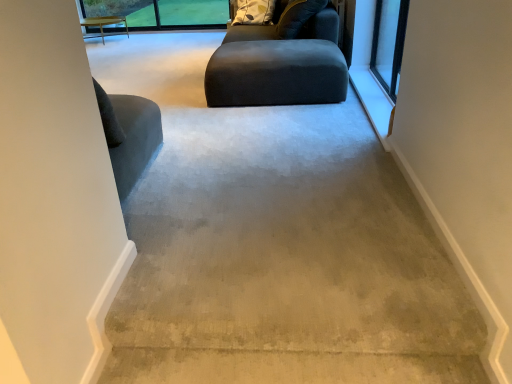
Question: Is clear glass window at upper right wider or thinner than dark gray fabric bean bag at center?

Choices:
 (A) wide
 (B) thin

Answer: (B)

Question: From the image's perspective, is clear glass window at upper right located above or below dark gray fabric bean bag at center?

Choices:
 (A) below
 (B) above

Answer: (A)

Question: Estimate the real-world distances between objects in this image. Which object is farther from the light wood table at upper left?

Choices:
 (A) patterned fabric pillow at upper center
 (B) clear glass window at upper right
 (C) matte black ottoman at center
 (D) dark gray fabric bean bag at center

Answer: (B)

Question: Based on their relative distances, which object is nearer to the dark gray fabric bean bag at center?

Choices:
 (A) clear glass window at upper right
 (B) light wood table at upper left
 (C) matte black ottoman at center
 (D) patterned fabric pillow at upper center

Answer: (D)